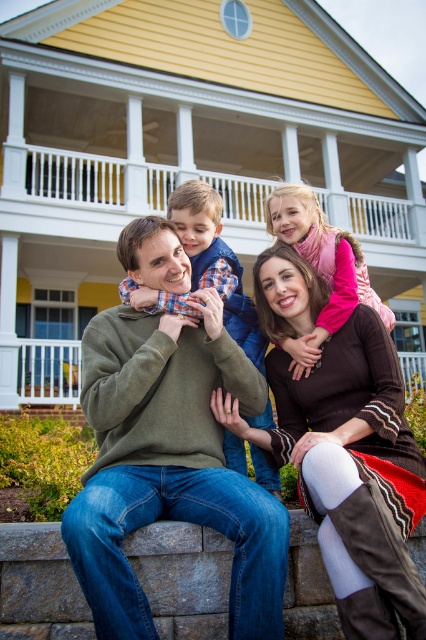
In the scene shown: Between stone ledge at lower center and pink fleece jacket at center, which one appears on the right side from the viewer's perspective?

pink fleece jacket at center

Which of these two, stone ledge at lower center or pink fleece jacket at center, stands taller?

With more height is pink fleece jacket at center.

Is point (39, 534) closer to camera compared to point (374, 292)?

Yes, it is in front of point (374, 292).

I want to click on stone ledge at lower center, so click(x=183, y=577).

Does white wooden railing at upper center have a lesser height compared to plaid shirt at center?

Incorrect, white wooden railing at upper center's height does not fall short of plaid shirt at center's.

Is point (48, 170) closer to camera compared to point (207, 189)?

No, it is behind (207, 189).

The height and width of the screenshot is (640, 426). Identify the location of white wooden railing at upper center. (89, 179).

Looking at this image, between white wooden railing at upper center and pink fleece jacket at center, which one is positioned higher?

white wooden railing at upper center is above.

Does white wooden railing at upper center appear over pink fleece jacket at center?

Indeed, white wooden railing at upper center is positioned over pink fleece jacket at center.

Between point (388, 202) and point (313, 211), which one is positioned behind?

Positioned behind is point (388, 202).

You are a GUI agent. You are given a task and a screenshot of the screen. Output one action in this format:
    pyautogui.click(x=<x>, y=<y>)
    Task: Click on the white wooden railing at upper center
    
    Given the screenshot: What is the action you would take?
    pyautogui.click(x=89, y=179)